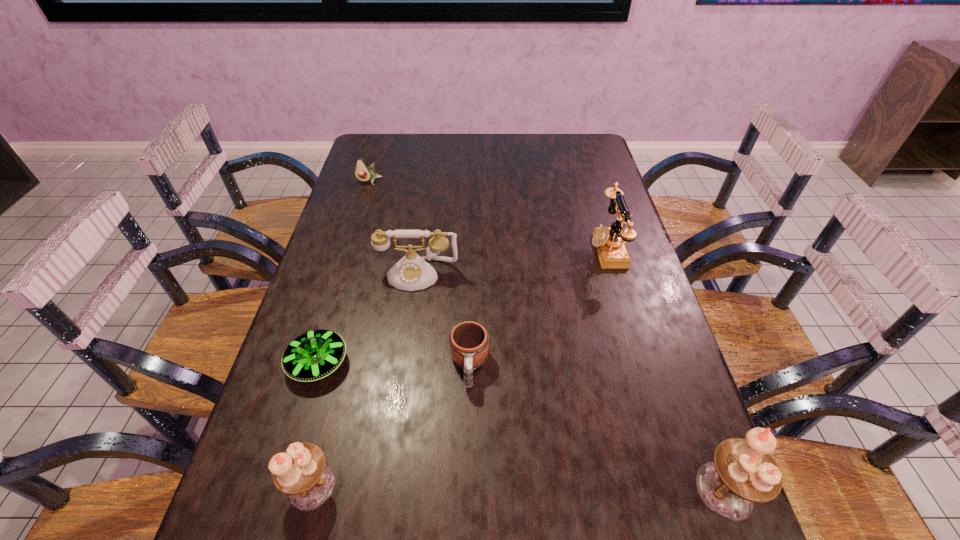
Identify the location of object that stands as the fifth closest to the right telephone. This screenshot has height=540, width=960. (363, 173).

The width and height of the screenshot is (960, 540). Find the location of `vacant position in the image that satisfies the following two spatial constraints: 1. on the dial of the right telephone; 2. on the dial of the left telephone`. vacant position in the image that satisfies the following two spatial constraints: 1. on the dial of the right telephone; 2. on the dial of the left telephone is located at coordinates (614, 274).

The height and width of the screenshot is (540, 960). I want to click on vacant space that satisfies the following two spatial constraints: 1. on the dial of the right telephone; 2. on the dial of the left telephone, so click(614, 274).